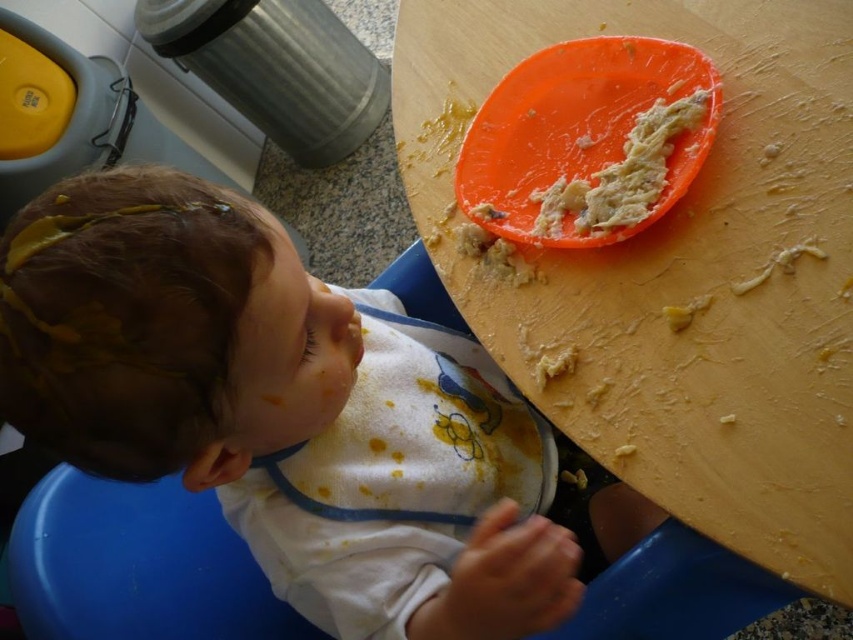
Question: Which of these objects is positioned closest to the orange plastic table at upper right?

Choices:
 (A) orange plastic plate at upper center
 (B) matte white bib at lower center

Answer: (A)

Question: Which point is closer to the camera?

Choices:
 (A) orange plastic plate at upper center
 (B) matte white bib at lower center
 (C) orange plastic table at upper right

Answer: (B)

Question: Which of the following is the farthest from the observer?

Choices:
 (A) orange plastic plate at upper center
 (B) orange plastic table at upper right

Answer: (A)

Question: Is matte white bib at lower center closer to camera compared to orange plastic table at upper right?

Choices:
 (A) no
 (B) yes

Answer: (B)

Question: Does orange plastic table at upper right appear on the left side of orange plastic plate at upper center?

Choices:
 (A) yes
 (B) no

Answer: (B)

Question: Can you confirm if matte white bib at lower center is positioned above orange plastic table at upper right?

Choices:
 (A) no
 (B) yes

Answer: (A)